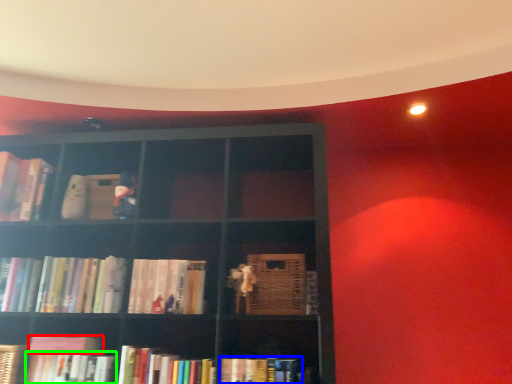
Question: Considering the real-world distances, which object is closest to book (highlighted by a red box)? book (highlighted by a blue box) or book (highlighted by a green box).

Choices:
 (A) book
 (B) book

Answer: (B)